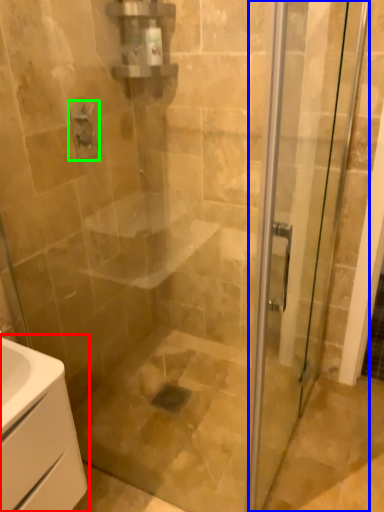
Question: Based on their relative distances, which object is farther from bathroom cabinet (highlighted by a red box)? Choose from door (highlighted by a blue box) and shower (highlighted by a green box).

Choices:
 (A) door
 (B) shower

Answer: (B)